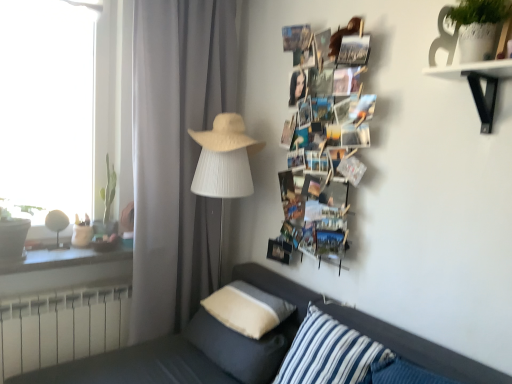
Question: Would you say beige woven fedora at center is to the left or to the right of gray matte curtain at center in the picture?

Choices:
 (A) right
 (B) left

Answer: (A)

Question: Is point (234, 132) positioned closer to the camera than point (204, 96)?

Choices:
 (A) closer
 (B) farther

Answer: (A)

Question: Estimate the real-world distances between objects in this image. Which object is closer to the white metallic radiator at lower left?

Choices:
 (A) matte wood window sill at left
 (B) beige woven fedora at center
 (C) white fabric lampshade at center, marked as the first table lamp in a right-to-left arrangement
 (D) white cotton pillow at lower center, which is the third pillow in front-to-back order
 (E) blue striped pillow at lower center, acting as the 1th pillow starting from the front

Answer: (A)

Question: Based on their relative distances, which object is farther from the printed paper collage at upper right?

Choices:
 (A) blue striped pillow at lower center, placed as the 3th pillow when sorted from back to front
 (B) gray matte curtain at center
 (C) dark gray fabric couch at lower left
 (D) soft beige pillow at lower center, the second pillow when ordered from back to front
 (E) matte white table lamp at left, which is the 2th table lamp in right-to-left order

Answer: (E)